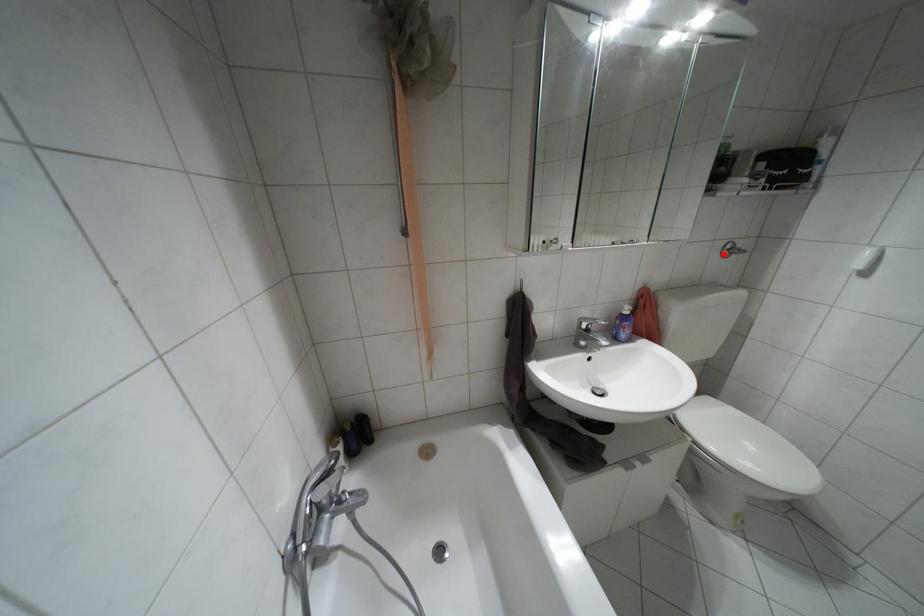
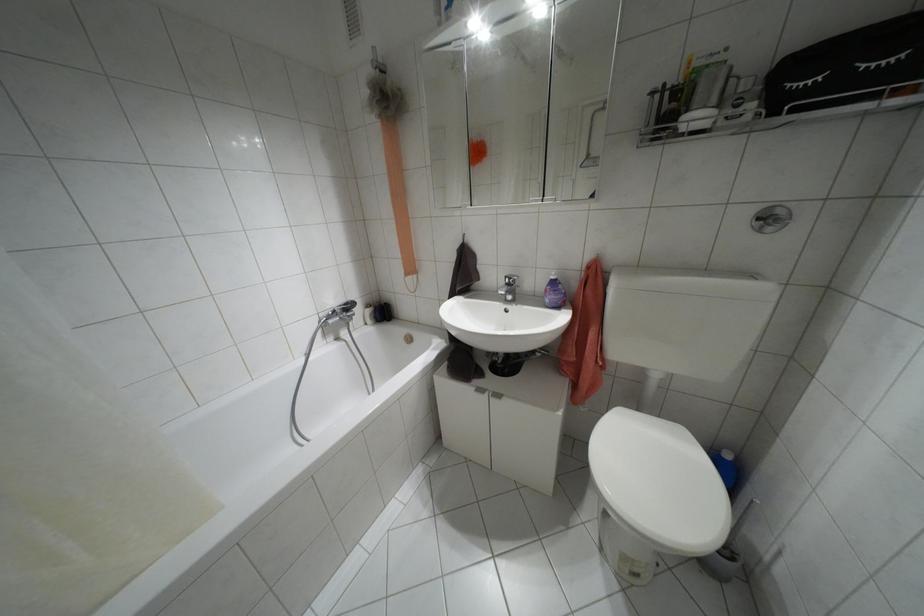
In the second image, find the point that corresponds to the highlighted location in the first image.

(769, 228)